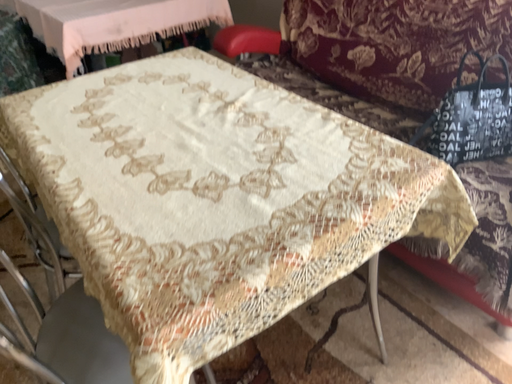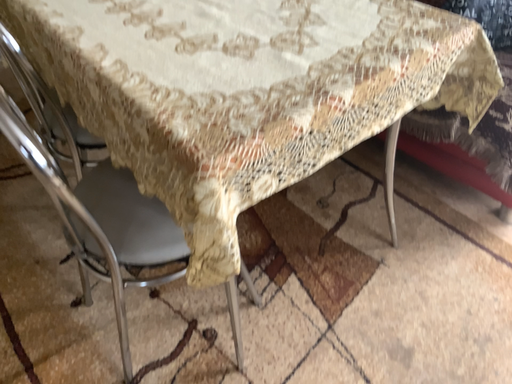
Question: How did the camera likely rotate when shooting the video?

Choices:
 (A) rotated upward
 (B) rotated downward

Answer: (B)